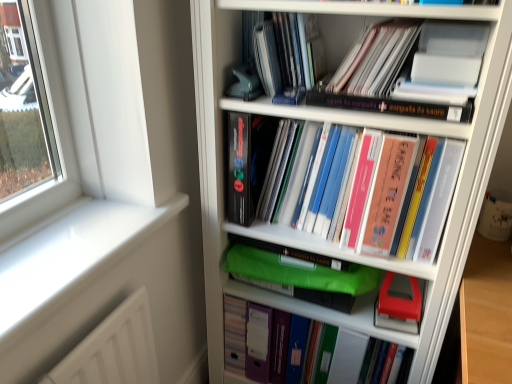
Question: Which direction should I rotate to look at hardcover book at upper center, placed as the third book when sorted from top to bottom, — up or down?

Choices:
 (A) up
 (B) down

Answer: (A)

Question: Does matte black book at upper center, which is the 1th book from top to bottom, lie in front of hardcover book at upper center, placed as the third book when sorted from top to bottom?

Choices:
 (A) yes
 (B) no

Answer: (B)

Question: From the image's perspective, is matte black book at upper center, placed as the fifth book when sorted from bottom to top, over hardcover book at upper center, placed as the third book when sorted from top to bottom?

Choices:
 (A) no
 (B) yes

Answer: (B)

Question: Is hardcover book at upper center, placed as the third book when sorted from top to bottom, a part of matte black book at upper center, placed as the fifth book when sorted from bottom to top?

Choices:
 (A) no
 (B) yes

Answer: (A)

Question: Is matte black book at upper center, which is the 1th book from top to bottom, to the right of hardcover book at upper center, placed as the third book when sorted from top to bottom, from the viewer's perspective?

Choices:
 (A) no
 (B) yes

Answer: (A)

Question: Is matte black book at upper center, which is the 1th book from top to bottom, oriented away from hardcover book at upper center, placed as the third book when sorted from top to bottom?

Choices:
 (A) yes
 (B) no

Answer: (B)

Question: Does matte black book at upper center, which is the 1th book from top to bottom, appear on the left side of hardcover book at upper center, positioned as the 3th book in bottom-to-top order?

Choices:
 (A) no
 (B) yes

Answer: (B)

Question: Considering the relative positions of red matte stapler at center and green plastic folder at center, the 5th book viewed from the top, in the image provided, is red matte stapler at center to the left of green plastic folder at center, the 5th book viewed from the top, from the viewer's perspective?

Choices:
 (A) no
 (B) yes

Answer: (A)

Question: Does red matte stapler at center lie behind green plastic folder at center, the 5th book viewed from the top?

Choices:
 (A) no
 (B) yes

Answer: (A)

Question: Considering the relative sizes of red matte stapler at center and green plastic folder at center, the 5th book viewed from the top, in the image provided, is red matte stapler at center shorter than green plastic folder at center, the 5th book viewed from the top,?

Choices:
 (A) no
 (B) yes

Answer: (B)

Question: Considering the relative positions of red matte stapler at center and green plastic folder at center, the 5th book viewed from the top, in the image provided, is red matte stapler at center to the right of green plastic folder at center, the 5th book viewed from the top, from the viewer's perspective?

Choices:
 (A) no
 (B) yes

Answer: (B)

Question: Is green plastic folder at center, arranged as the 1th book when ordered from the bottom, at the back of red matte stapler at center?

Choices:
 (A) yes
 (B) no

Answer: (B)

Question: Is red matte stapler at center not within green plastic folder at center, arranged as the 1th book when ordered from the bottom?

Choices:
 (A) no
 (B) yes

Answer: (B)

Question: Considering the relative sizes of hardcover book at center, the fourth book viewed from the top, and green plastic folder at center, arranged as the 1th book when ordered from the bottom, in the image provided, is hardcover book at center, the fourth book viewed from the top, thinner than green plastic folder at center, arranged as the 1th book when ordered from the bottom,?

Choices:
 (A) no
 (B) yes

Answer: (A)